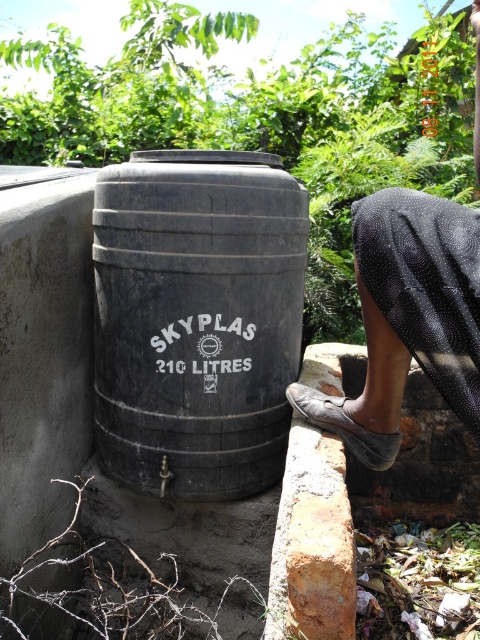
Question: Can you confirm if black matte barrel at center is positioned to the left of black mesh cloth at upper right?

Choices:
 (A) yes
 (B) no

Answer: (A)

Question: Does black matte barrel at center appear on the left side of black mesh cloth at upper right?

Choices:
 (A) no
 (B) yes

Answer: (B)

Question: Among these objects, which one is nearest to the camera?

Choices:
 (A) black matte barrel at center
 (B) black mesh cloth at upper right

Answer: (B)

Question: Does black matte barrel at center appear under black mesh cloth at upper right?

Choices:
 (A) yes
 (B) no

Answer: (A)